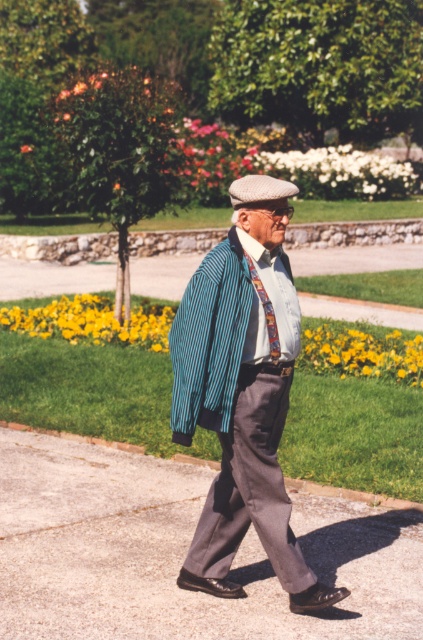
Between point (137, 564) and point (258, 296), which one is positioned behind?

Point (137, 564)

The width and height of the screenshot is (423, 640). Identify the location of gray concrete pavement at lower center. (180, 554).

Image resolution: width=423 pixels, height=640 pixels. I want to click on gray concrete pavement at lower center, so click(180, 554).

Consider the image. Is striped wool sweater at center in front of patterned silk tie at center?

Yes, striped wool sweater at center is in front of patterned silk tie at center.

The image size is (423, 640). In order to click on striped wool sweater at center in this screenshot , I will do `click(242, 394)`.

What are the coordinates of `striped wool sweater at center` in the screenshot? It's located at (242, 394).

Does gray concrete pavement at lower center come in front of striped wool sweater at center?

Yes.

Image resolution: width=423 pixels, height=640 pixels. What do you see at coordinates (180, 554) in the screenshot?
I see `gray concrete pavement at lower center` at bounding box center [180, 554].

Identify the location of gray concrete pavement at lower center. (180, 554).